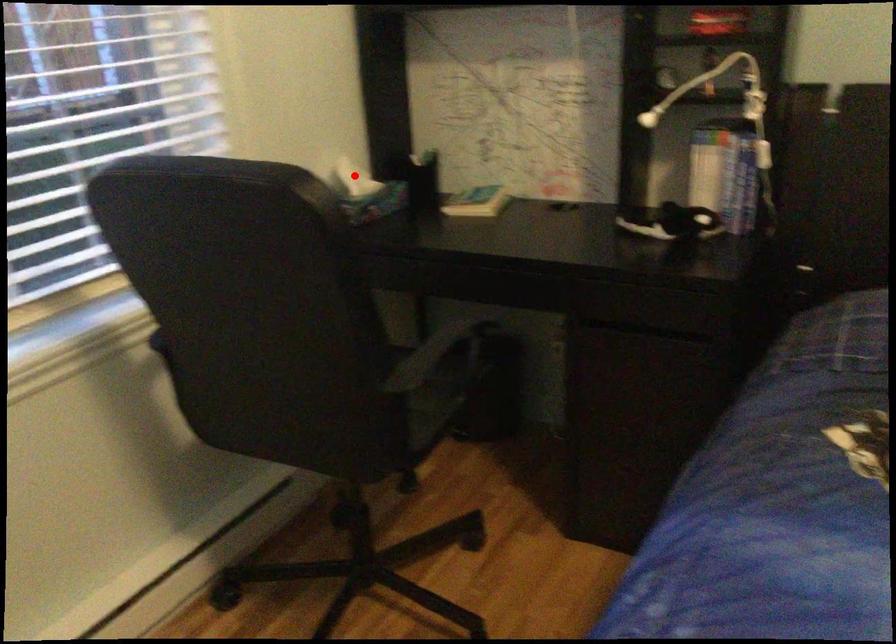
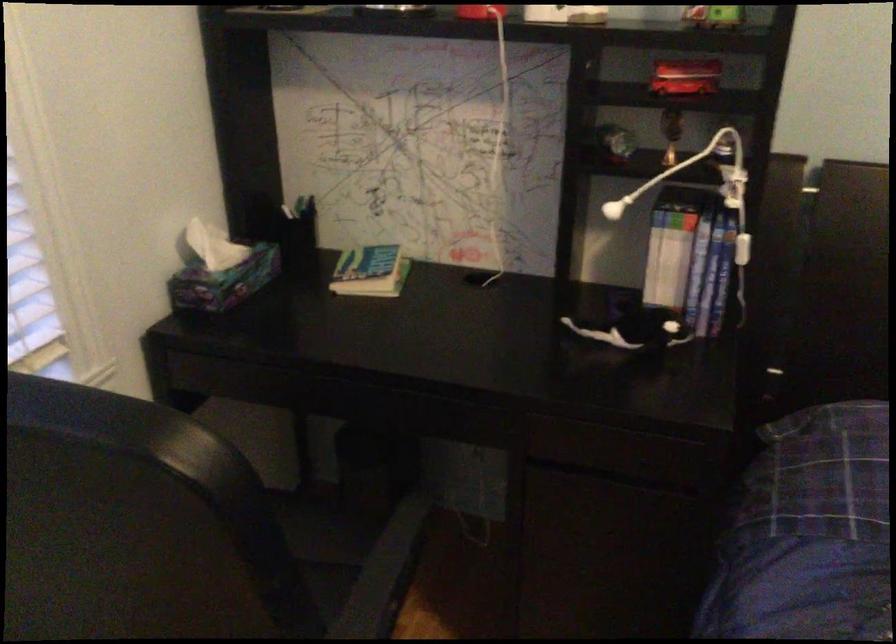
Question: I am providing you with two images of the same scene from different viewpoints. A red point is marked on the first image. Can you still see the location of the red point in image 2?

Choices:
 (A) Yes
 (B) No

Answer: (A)